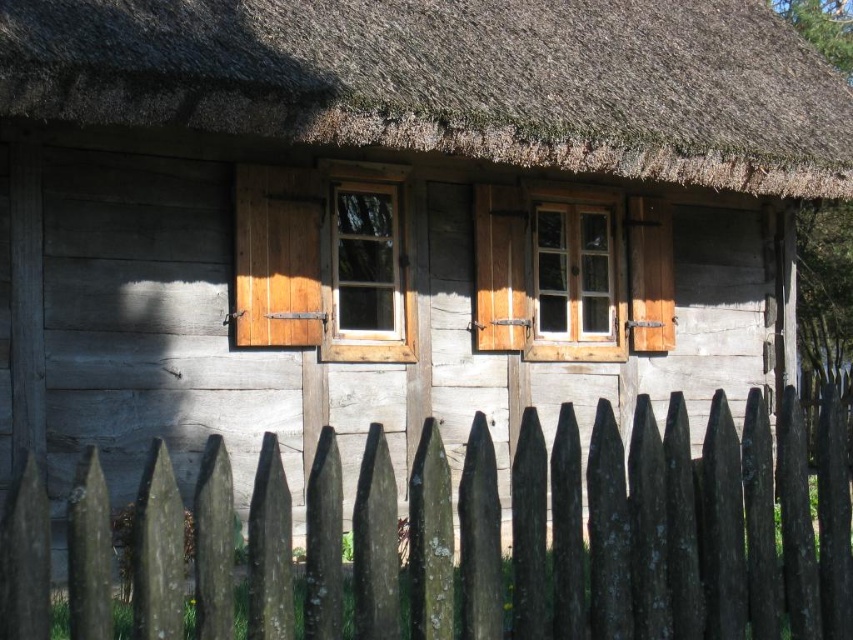
Question: Which point is farther to the camera?

Choices:
 (A) brown thatch at upper center
 (B) weathered wood fence at center

Answer: (A)

Question: Which object is farther from the camera taking this photo?

Choices:
 (A) white wood window at center
 (B) brown thatch at upper center
 (C) wooden window at center

Answer: (A)

Question: Can you confirm if wooden window at center is positioned to the right of white wood window at center?

Choices:
 (A) yes
 (B) no

Answer: (B)

Question: Which is nearer to the wooden window at center?

Choices:
 (A) brown thatch at upper center
 (B) weathered wood fence at center
 (C) white wood window at center

Answer: (C)

Question: Is weathered wood fence at center to the right of brown thatch at upper center from the viewer's perspective?

Choices:
 (A) no
 (B) yes

Answer: (A)

Question: Can you confirm if weathered wood fence at center is smaller than brown thatch at upper center?

Choices:
 (A) no
 (B) yes

Answer: (B)